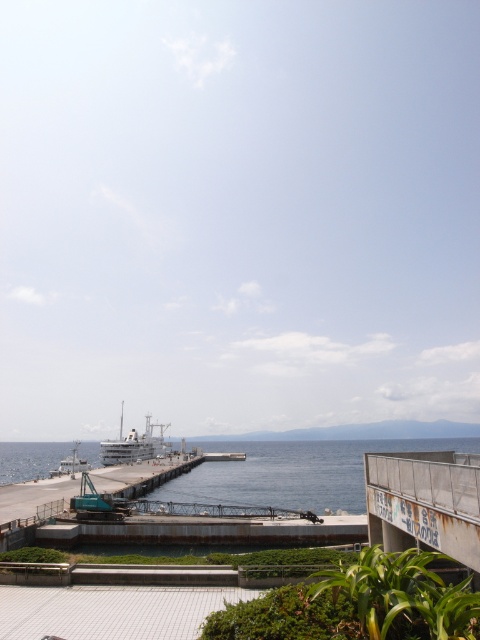
Question: Does blue water at lower left have a smaller size compared to white matte ship at lower left?

Choices:
 (A) no
 (B) yes

Answer: (A)

Question: Can you confirm if white matte ship at lower left is positioned below white glossy ship at center?

Choices:
 (A) yes
 (B) no

Answer: (A)

Question: Estimate the real-world distances between objects in this image. Which object is farther from the white matte ship at lower left?

Choices:
 (A) blue water at lower left
 (B) rusty metal dock at lower right

Answer: (B)

Question: Can you confirm if blue water at lower left is positioned to the right of rusty metal dock at lower right?

Choices:
 (A) yes
 (B) no

Answer: (B)

Question: Which point is closer to the camera taking this photo?

Choices:
 (A) (427, 465)
 (B) (80, 442)
 (C) (118, 451)
 (D) (184, 483)

Answer: (A)

Question: Which object appears farthest from the camera in this image?

Choices:
 (A) rusty metal dock at lower right
 (B) blue water at lower left
 (C) white glossy ship at center
 (D) white matte ship at lower left

Answer: (D)